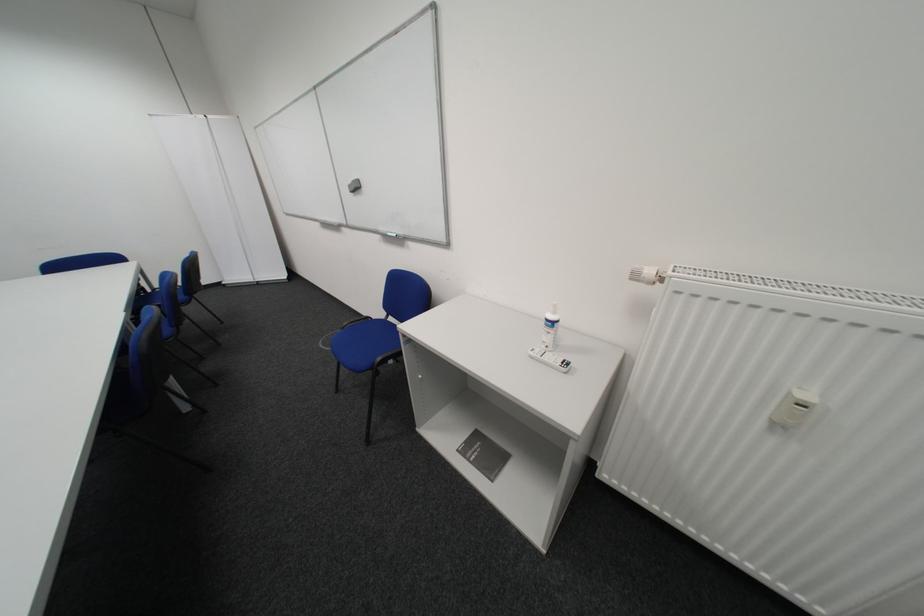
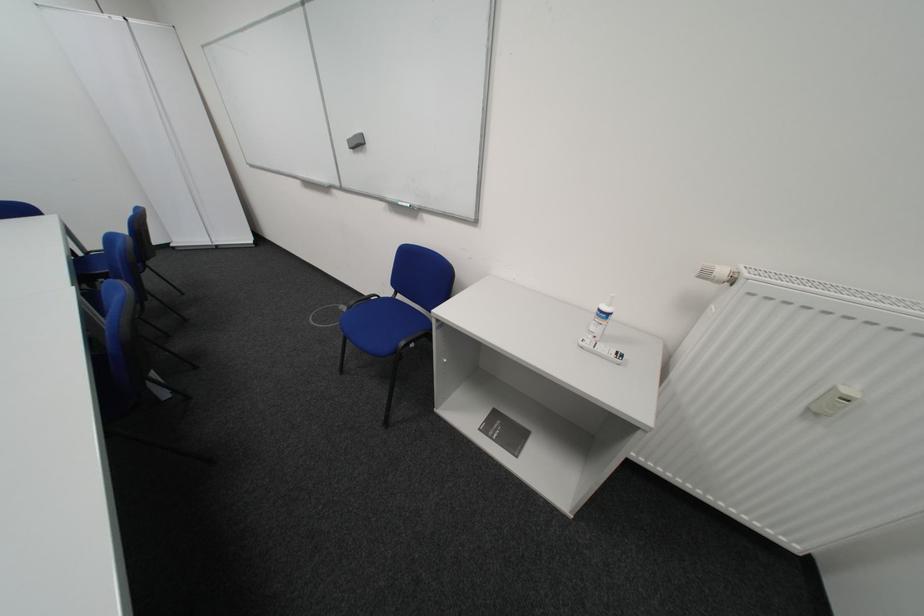
Find the pixel in the second image that matches point 361,188 in the first image.

(361, 143)